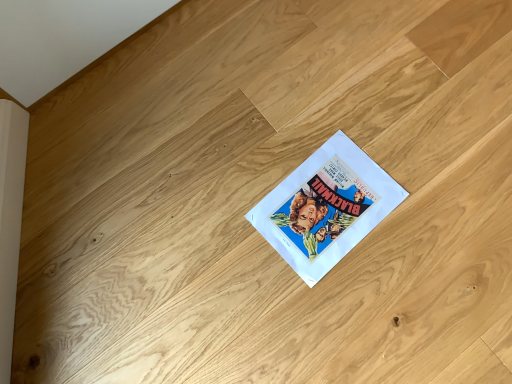
Find the location of `vacant space positioned to the left of white paper at center`. vacant space positioned to the left of white paper at center is located at coordinates (220, 230).